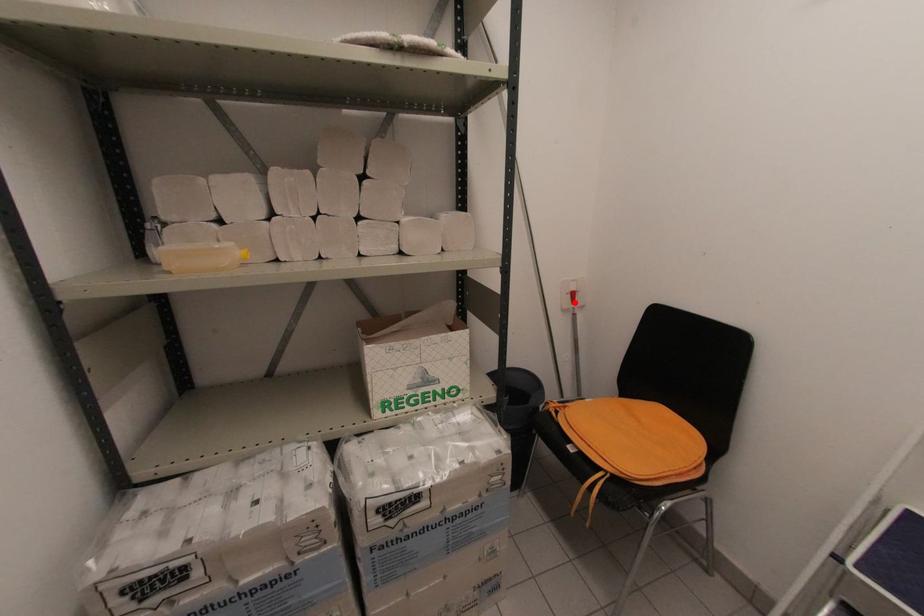
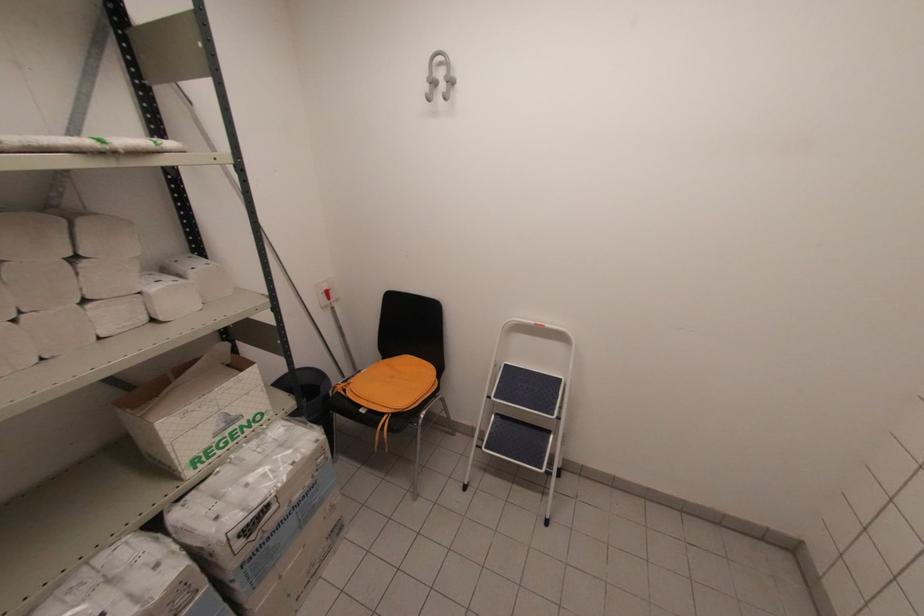
Locate, in the second image, the point that corresponds to the highlighted location in the first image.

(330, 299)